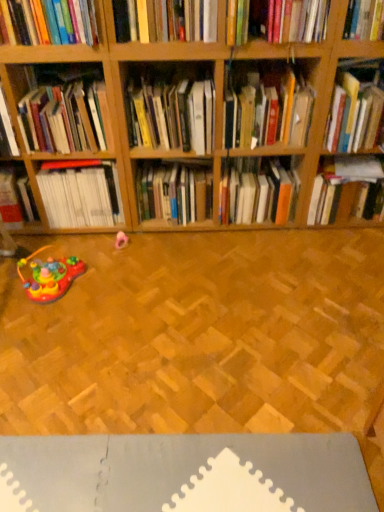
You are a GUI agent. You are given a task and a screenshot of the screen. Output one action in this format:
    pyautogui.click(x=<x>, y=<y>)
    Task: Click on the blank area beneath rubberized plastic toy at lower left, which appears as the 2th toy when viewed from the top (from a real-world perspective)
    The image size is (384, 512).
    Given the screenshot: What is the action you would take?
    click(61, 290)